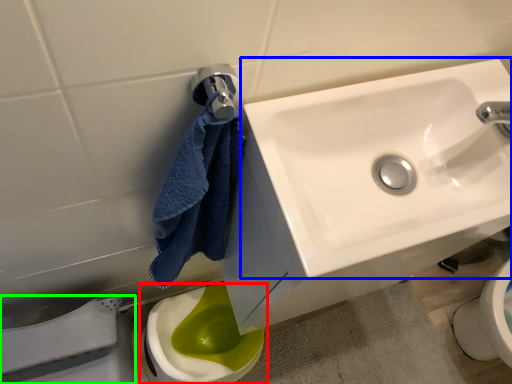
Question: Based on their relative distances, which object is nearer to toilet (highlighted by a red box)? Choose from sink (highlighted by a blue box) and porcelain (highlighted by a green box).

Choices:
 (A) sink
 (B) porcelain

Answer: (B)